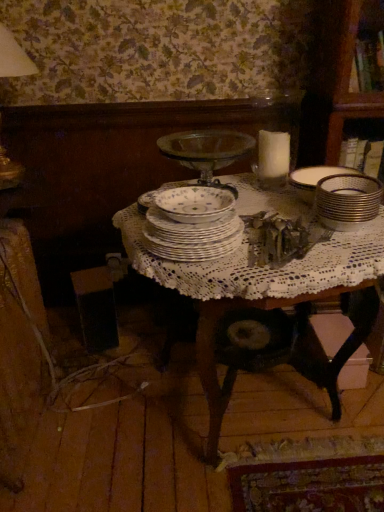
I want to click on vacant space situated on the left part of gold metallic stack at right, so click(x=307, y=237).